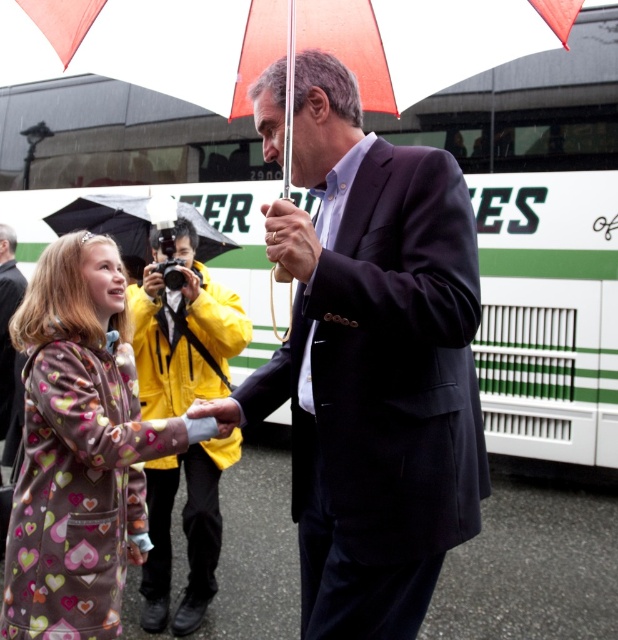
Question: Which of these objects is positioned farthest from the matte black suit at center?

Choices:
 (A) white/green striped bus at center
 (B) fluffy fleece coat at center

Answer: (A)

Question: Where is orange fabric umbrella at upper center located in relation to smooth white paper at center in the image?

Choices:
 (A) left
 (B) right

Answer: (B)

Question: Is fluffy fleece coat at center positioned at the back of smooth white paper at center?

Choices:
 (A) yes
 (B) no

Answer: (B)

Question: Is white/green striped bus at center further to the viewer compared to black matte umbrella at upper center?

Choices:
 (A) no
 (B) yes

Answer: (B)

Question: Which of the following is the closest to the observer?

Choices:
 (A) (218, 406)
 (B) (201, 250)
 (C) (148, 44)
 (D) (295, 355)

Answer: (D)

Question: Which is farther from the smooth white paper at center?

Choices:
 (A) matte black suit at center
 (B) white/green striped bus at center
 (C) matte black umbrella at center
 (D) black matte umbrella at upper center

Answer: (B)